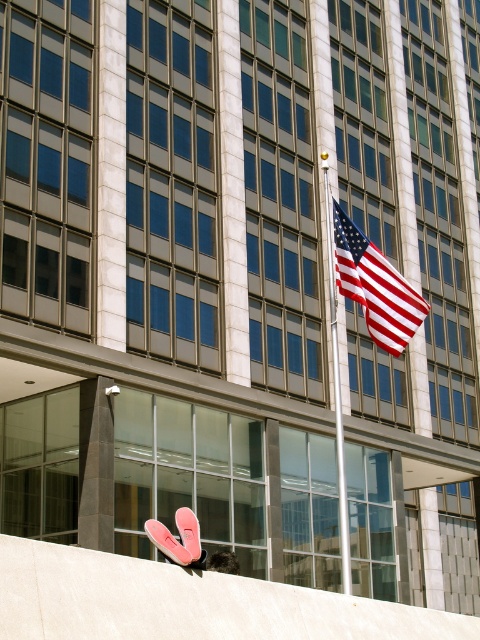
Question: Observing the image, what is the correct spatial positioning of american flag at center in reference to white glossy flag pole at center?

Choices:
 (A) below
 (B) above

Answer: (B)

Question: Does american flag at center have a smaller size compared to white glossy flag pole at center?

Choices:
 (A) no
 (B) yes

Answer: (B)

Question: Which of the following is the closest to the observer?

Choices:
 (A) white glossy flag pole at center
 (B) american flag at center

Answer: (A)

Question: Is american flag at center to the right of white glossy flag pole at center from the viewer's perspective?

Choices:
 (A) yes
 (B) no

Answer: (A)

Question: Which of the following is the closest to the observer?

Choices:
 (A) american flag at center
 (B) white glossy flag pole at center

Answer: (B)